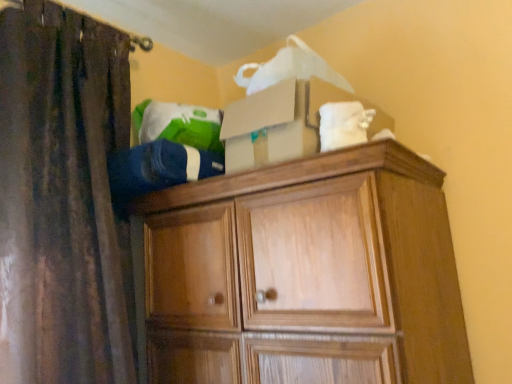
Find the location of a particular element. This screenshot has height=384, width=512. white fabric at upper right, marked as the 1th clothing in a right-to-left arrangement is located at coordinates (343, 124).

What is the approximate height of wooden cabinet at upper center?

The height of wooden cabinet at upper center is 28.86 inches.

Measure the distance between point (150, 143) and camera.

Point (150, 143) is 1.16 meters from camera.

The height and width of the screenshot is (384, 512). Describe the element at coordinates (158, 168) in the screenshot. I see `blue fleece jacket at upper center, the 2th clothing when ordered from right to left` at that location.

You are a GUI agent. You are given a task and a screenshot of the screen. Output one action in this format:
    pyautogui.click(x=<x>, y=<y>)
    Task: Click on the white fabric at upper right, marked as the 1th clothing in a right-to-left arrangement
    This screenshot has width=512, height=384.
    Given the screenshot: What is the action you would take?
    pyautogui.click(x=343, y=124)

In terms of size, does brown fabric curtain at left appear bigger or smaller than blue fleece jacket at upper center, the 1th clothing from the left?

Clearly, brown fabric curtain at left is larger in size than blue fleece jacket at upper center, the 1th clothing from the left.

Considering the sizes of objects brown fabric curtain at left and blue fleece jacket at upper center, the 2th clothing when ordered from right to left, in the image provided, who is taller, brown fabric curtain at left or blue fleece jacket at upper center, the 2th clothing when ordered from right to left,?

brown fabric curtain at left.

Image resolution: width=512 pixels, height=384 pixels. In order to click on the 1st clothing above when counting from the brown fabric curtain at left (from the image's perspective) in this screenshot , I will do `click(158, 168)`.

Could you measure the distance between wooden cabinet at upper center and blue fleece jacket at upper center, the 2th clothing when ordered from right to left?

wooden cabinet at upper center is 11.55 inches from blue fleece jacket at upper center, the 2th clothing when ordered from right to left.

What's the angular difference between wooden cabinet at upper center and blue fleece jacket at upper center, the 1th clothing from the left,'s facing directions?

There is a 5.07-degree angle between the facing directions of wooden cabinet at upper center and blue fleece jacket at upper center, the 1th clothing from the left.

In terms of size, does wooden cabinet at upper center appear bigger or smaller than blue fleece jacket at upper center, the 1th clothing from the left?

In the image, wooden cabinet at upper center appears to be larger than blue fleece jacket at upper center, the 1th clothing from the left.

Is wooden cabinet at upper center not near blue fleece jacket at upper center, the 2th clothing when ordered from right to left?

wooden cabinet at upper center is actually quite close to blue fleece jacket at upper center, the 2th clothing when ordered from right to left.

Based on their sizes in the image, would you say blue fleece jacket at upper center, the 2th clothing when ordered from right to left, is bigger or smaller than white fabric at upper right, acting as the 2th clothing starting from the left?

blue fleece jacket at upper center, the 2th clothing when ordered from right to left, is bigger than white fabric at upper right, acting as the 2th clothing starting from the left.

From a real-world perspective, is blue fleece jacket at upper center, the 1th clothing from the left, above or below white fabric at upper right, acting as the 2th clothing starting from the left?

In terms of real-world spatial position, blue fleece jacket at upper center, the 1th clothing from the left, is below white fabric at upper right, acting as the 2th clothing starting from the left.

Between blue fleece jacket at upper center, the 2th clothing when ordered from right to left, and white fabric at upper right, marked as the 1th clothing in a right-to-left arrangement, which one has larger width?

Wider between the two is blue fleece jacket at upper center, the 2th clothing when ordered from right to left.

Are wooden cabinet at upper center and brown fabric curtain at left located far from each other?

No, wooden cabinet at upper center is not far away from brown fabric curtain at left.

Is wooden cabinet at upper center surrounding brown fabric curtain at left?

No, brown fabric curtain at left is not inside wooden cabinet at upper center.

Can you tell me how much wooden cabinet at upper center and brown fabric curtain at left differ in facing direction?

The facing directions of wooden cabinet at upper center and brown fabric curtain at left are 90.1 degrees apart.

Could you tell me if wooden cabinet at upper center is facing brown fabric curtain at left?

Yes.

The width and height of the screenshot is (512, 384). What are the coordinates of `cupboard below the white fabric at upper right, acting as the 2th clothing starting from the left (from a real-world perspective)` in the screenshot? It's located at (315, 257).

Which is closer to the camera, (324, 141) or (358, 250)?

The point (358, 250) is more forward.

Considering the sizes of objects white fabric at upper right, acting as the 2th clothing starting from the left, and wooden cabinet at upper center in the image provided, who is smaller, white fabric at upper right, acting as the 2th clothing starting from the left, or wooden cabinet at upper center?

white fabric at upper right, acting as the 2th clothing starting from the left.

Is blue fleece jacket at upper center, the 1th clothing from the left, positioned in front of brown fabric curtain at left?

No, blue fleece jacket at upper center, the 1th clothing from the left, is further to the viewer.

Is blue fleece jacket at upper center, the 2th clothing when ordered from right to left, at the right side of brown fabric curtain at left?

Indeed, blue fleece jacket at upper center, the 2th clothing when ordered from right to left, is positioned on the right side of brown fabric curtain at left.

Which point is more forward, (124, 172) or (117, 285)?

The point (117, 285) is closer.

Is blue fleece jacket at upper center, the 2th clothing when ordered from right to left, beside brown fabric curtain at left?

There is a gap between blue fleece jacket at upper center, the 2th clothing when ordered from right to left, and brown fabric curtain at left.

Can you confirm if white fabric at upper right, acting as the 2th clothing starting from the left, is bigger than brown fabric curtain at left?

No, white fabric at upper right, acting as the 2th clothing starting from the left, is not bigger than brown fabric curtain at left.

Considering the positions of objects white fabric at upper right, marked as the 1th clothing in a right-to-left arrangement, and brown fabric curtain at left in the image provided, who is more to the right, white fabric at upper right, marked as the 1th clothing in a right-to-left arrangement, or brown fabric curtain at left?

Positioned to the right is white fabric at upper right, marked as the 1th clothing in a right-to-left arrangement.

Which object is wider, white fabric at upper right, acting as the 2th clothing starting from the left, or brown fabric curtain at left?

Wider between the two is brown fabric curtain at left.

You are a GUI agent. You are given a task and a screenshot of the screen. Output one action in this format:
    pyautogui.click(x=<x>, y=<y>)
    Task: Click on the curtain beneath the blue fleece jacket at upper center, the 2th clothing when ordered from right to left (from a real-world perspective)
    The height and width of the screenshot is (384, 512).
    Given the screenshot: What is the action you would take?
    pyautogui.click(x=62, y=196)

At what (x,y) coordinates should I click in order to perform the action: click on cupboard in front of the blue fleece jacket at upper center, the 2th clothing when ordered from right to left. Please return your answer as a coordinate pair (x, y). The width and height of the screenshot is (512, 384). Looking at the image, I should click on (315, 257).

From the image, which object appears to be farther from brown fabric curtain at left, blue fleece jacket at upper center, the 2th clothing when ordered from right to left, or wooden cabinet at upper center?

The object further to brown fabric curtain at left is wooden cabinet at upper center.

When comparing their distances from brown fabric curtain at left, does wooden cabinet at upper center or blue fleece jacket at upper center, the 1th clothing from the left, seem further?

The object further to brown fabric curtain at left is wooden cabinet at upper center.

Looking at this image, based on their spatial positions, is brown fabric curtain at left or wooden cabinet at upper center further from blue fleece jacket at upper center, the 1th clothing from the left?

wooden cabinet at upper center.

In the scene shown: Considering their positions, is white fabric at upper right, acting as the 2th clothing starting from the left, positioned closer to brown fabric curtain at left than blue fleece jacket at upper center, the 2th clothing when ordered from right to left?

Among the two, blue fleece jacket at upper center, the 2th clothing when ordered from right to left, is located nearer to brown fabric curtain at left.

Looking at the image, which one is located further to white fabric at upper right, acting as the 2th clothing starting from the left, wooden cabinet at upper center or brown fabric curtain at left?

brown fabric curtain at left is further to white fabric at upper right, acting as the 2th clothing starting from the left.

Estimate the real-world distances between objects in this image. Which object is closer to blue fleece jacket at upper center, the 1th clothing from the left, wooden cabinet at upper center or white fabric at upper right, acting as the 2th clothing starting from the left?

Based on the image, wooden cabinet at upper center appears to be nearer to blue fleece jacket at upper center, the 1th clothing from the left.

Consider the image. Considering their positions, is brown fabric curtain at left positioned closer to white fabric at upper right, acting as the 2th clothing starting from the left, than blue fleece jacket at upper center, the 1th clothing from the left?

blue fleece jacket at upper center, the 1th clothing from the left, lies closer to white fabric at upper right, acting as the 2th clothing starting from the left, than the other object.

Considering their positions, is wooden cabinet at upper center positioned further to blue fleece jacket at upper center, the 1th clothing from the left, than brown fabric curtain at left?

Among the two, wooden cabinet at upper center is located further to blue fleece jacket at upper center, the 1th clothing from the left.

Locate an element on the screen. clothing situated between brown fabric curtain at left and white fabric at upper right, acting as the 2th clothing starting from the left, from left to right is located at coordinates (158, 168).

At what (x,y) coordinates should I click in order to perform the action: click on clothing between white fabric at upper right, acting as the 2th clothing starting from the left, and wooden cabinet at upper center from top to bottom. Please return your answer as a coordinate pair (x, y). Looking at the image, I should click on (158, 168).

The image size is (512, 384). I want to click on clothing located between brown fabric curtain at left and wooden cabinet at upper center in the left-right direction, so pyautogui.click(x=158, y=168).

Where is `cupboard located between brown fabric curtain at left and white fabric at upper right, marked as the 1th clothing in a right-to-left arrangement, in the left-right direction`? cupboard located between brown fabric curtain at left and white fabric at upper right, marked as the 1th clothing in a right-to-left arrangement, in the left-right direction is located at coordinates (315, 257).